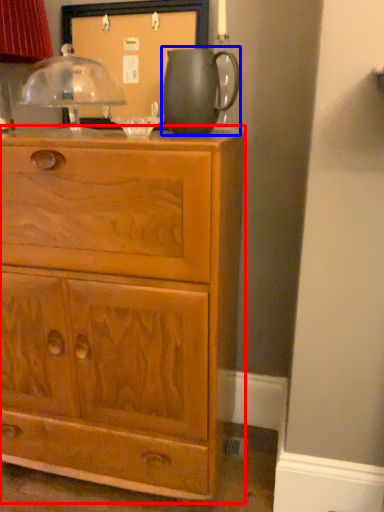
Question: Among these objects, which one is farthest to the camera, chest of drawers (highlighted by a red box) or jug (highlighted by a blue box)?

Choices:
 (A) chest of drawers
 (B) jug

Answer: (B)